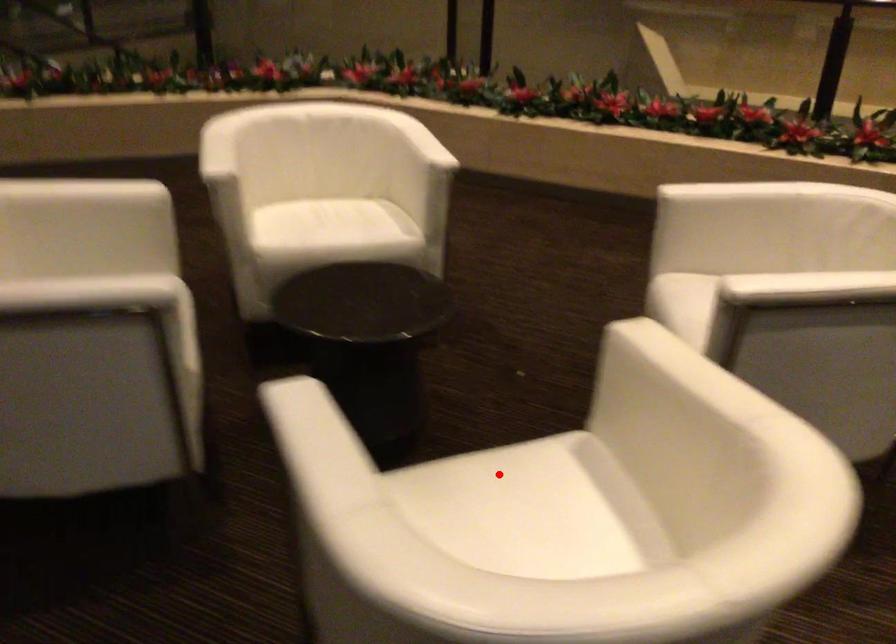
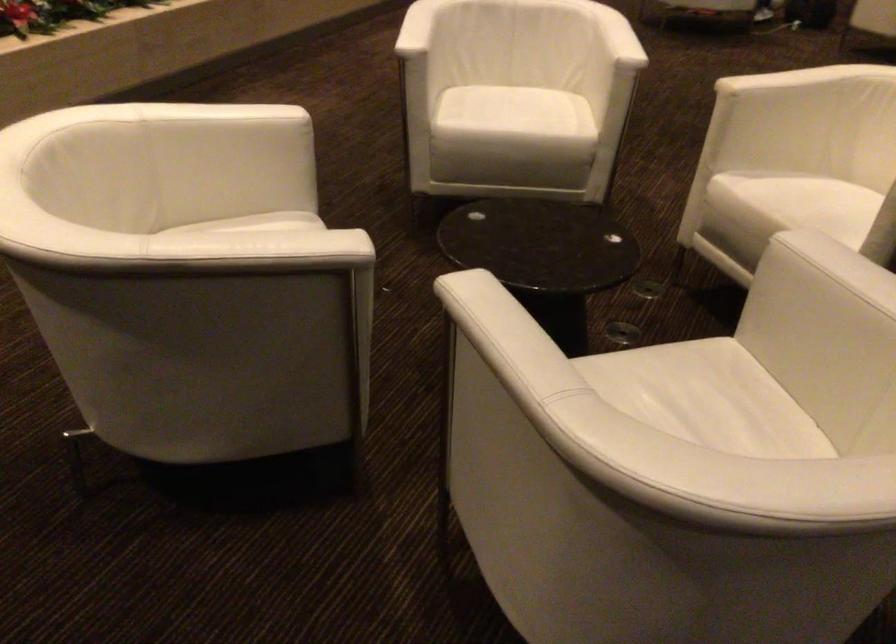
The point at the highlighted location is marked in the first image. Where is the corresponding point in the second image?

(794, 198)